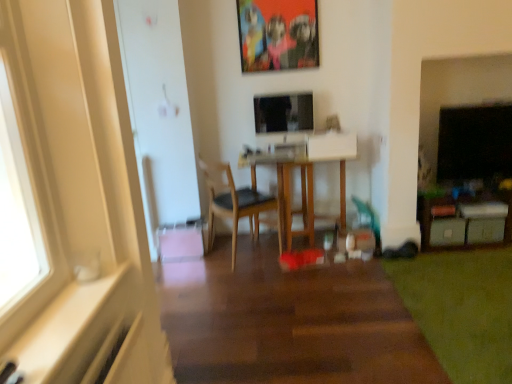
Image resolution: width=512 pixels, height=384 pixels. I want to click on free space to the left of green soft carpet at lower right, so click(x=314, y=304).